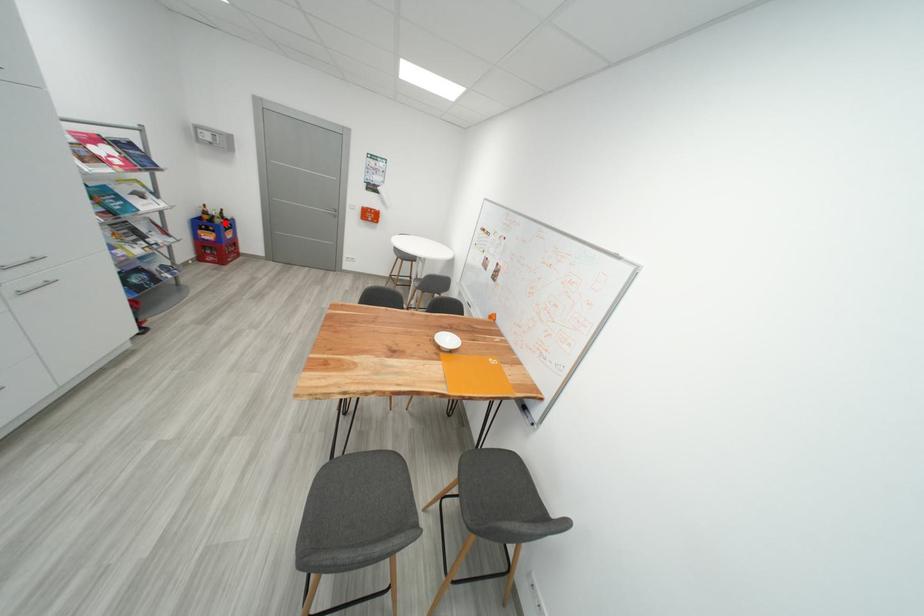
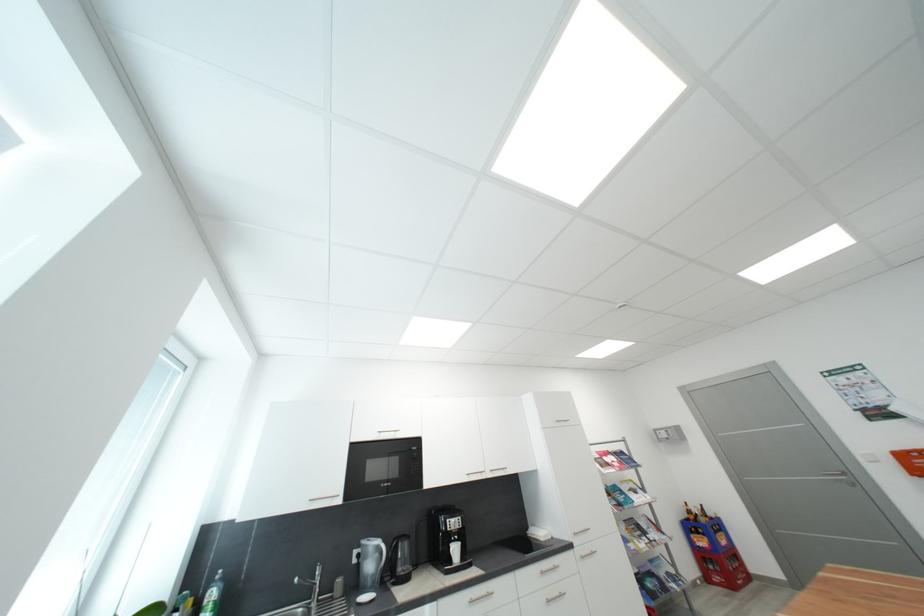
Question: I am providing you with two images of the same scene from different viewpoints. Image1 has a red point marked. In image2, the corresponding 3D location appears at what relative position? Reply with the corresponding letter.

Choices:
 (A) Closer
 (B) Farther

Answer: (B)